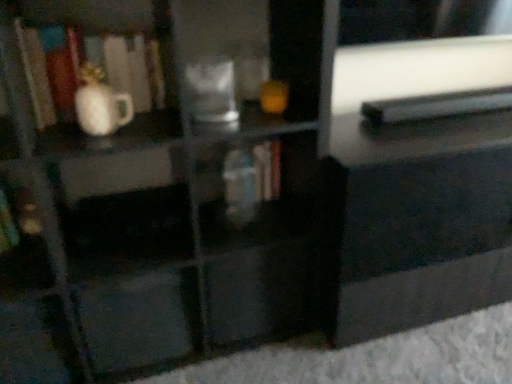
Question: Is white glossy vase at left outside black plastic book at upper right, the 3th book viewed from the left?

Choices:
 (A) no
 (B) yes

Answer: (B)

Question: Does white glossy vase at left lie behind black plastic book at upper right, the 3th book viewed from the left?

Choices:
 (A) yes
 (B) no

Answer: (B)

Question: Considering the relative sizes of white glossy vase at left and black plastic book at upper right, positioned as the 1th book in right-to-left order, in the image provided, is white glossy vase at left wider than black plastic book at upper right, positioned as the 1th book in right-to-left order,?

Choices:
 (A) no
 (B) yes

Answer: (A)

Question: Is white glossy vase at left at the right side of black plastic book at upper right, positioned as the 1th book in right-to-left order?

Choices:
 (A) yes
 (B) no

Answer: (B)

Question: Is white glossy vase at left positioned far away from black plastic book at upper right, the 3th book viewed from the left?

Choices:
 (A) yes
 (B) no

Answer: (B)

Question: Do you think hardcover book at center, the second book viewed from the left, is within black glossy drawer at center, which is the 1th drawer from right to left, or outside of it?

Choices:
 (A) outside
 (B) inside

Answer: (A)

Question: From their relative heights in the image, would you say hardcover book at center, the second book viewed from the left, is taller or shorter than black glossy drawer at center, the 2th drawer viewed from the left?

Choices:
 (A) short
 (B) tall

Answer: (A)

Question: Considering the positions of hardcover book at center, which is the 2th book from right to left, and black glossy drawer at center, which is the 1th drawer from right to left, in the image, is hardcover book at center, which is the 2th book from right to left, bigger or smaller than black glossy drawer at center, which is the 1th drawer from right to left,?

Choices:
 (A) big
 (B) small

Answer: (B)

Question: Relative to black glossy drawer at center, the 2th drawer viewed from the left, is hardcover book at center, the second book viewed from the left, in front or behind?

Choices:
 (A) behind
 (B) front

Answer: (A)

Question: From their relative heights in the image, would you say matte black drawer at center, which is counted as the 2th drawer, starting from the right, is taller or shorter than white glossy vase at left?

Choices:
 (A) tall
 (B) short

Answer: (A)

Question: Do you think matte black drawer at center, the first drawer positioned from the left, is within white glossy vase at left, or outside of it?

Choices:
 (A) inside
 (B) outside

Answer: (B)

Question: Looking at their shapes, would you say matte black drawer at center, which is counted as the 2th drawer, starting from the right, is wider or thinner than white glossy vase at left?

Choices:
 (A) thin
 (B) wide

Answer: (B)

Question: Visually, is matte black drawer at center, the first drawer positioned from the left, positioned to the left or to the right of white glossy vase at left?

Choices:
 (A) right
 (B) left

Answer: (A)

Question: In terms of width, does black glossy drawer at center, the 2th drawer viewed from the left, look wider or thinner when compared to hardcover book at center, the second book viewed from the left?

Choices:
 (A) thin
 (B) wide

Answer: (B)

Question: Is point (295, 274) closer or farther from the camera than point (258, 158)?

Choices:
 (A) closer
 (B) farther

Answer: (A)